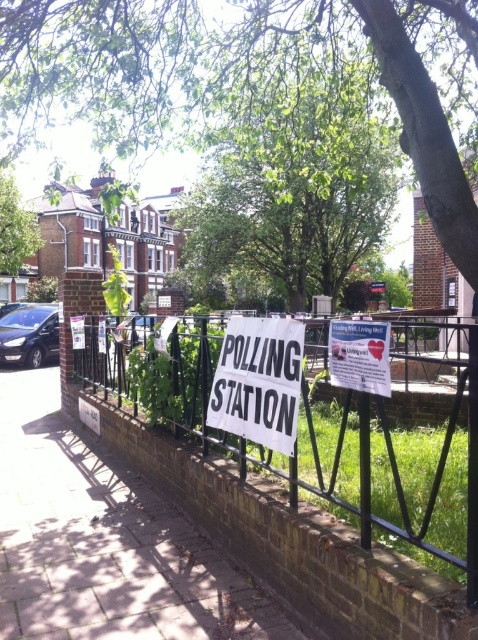
Question: Which point is closer to the camera?

Choices:
 (A) (94, 577)
 (B) (330, 378)

Answer: (A)

Question: Is white concrete pavement at center to the right of green leafy tree at center from the viewer's perspective?

Choices:
 (A) yes
 (B) no

Answer: (B)

Question: Which object is the closest to the green leafy tree at center?

Choices:
 (A) black metal fence at center
 (B) white paper sign at center

Answer: (A)

Question: Can you confirm if green leafy tree at upper center is positioned above black metal fence at center?

Choices:
 (A) yes
 (B) no

Answer: (A)

Question: Considering the real-world distances, which object is closest to the green leafy tree at upper center?

Choices:
 (A) green leafy tree at center
 (B) white concrete pavement at center
 (C) white paper poster at center

Answer: (A)

Question: Can you confirm if green leafy tree at upper center is thinner than black metal fence at center?

Choices:
 (A) no
 (B) yes

Answer: (A)